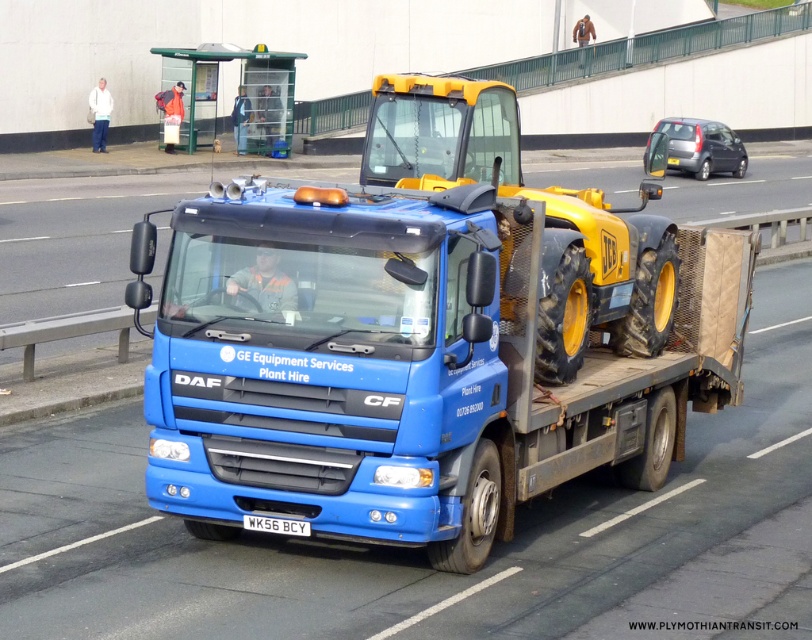
You are a traffic officer observing a blue matte truck at center and a white plastic license plate at center in the scene. Which object is located to the left?

The white plastic license plate at center is located to the left of the blue matte truck at center.

You are a photographer trying to capture the blue matte truck at center and the white plastic license plate at center in a single shot. Considering their sizes, which object will occupy more space in your photo?

The blue matte truck at center will occupy more space in the photo since its width is larger than the white plastic license plate at center.